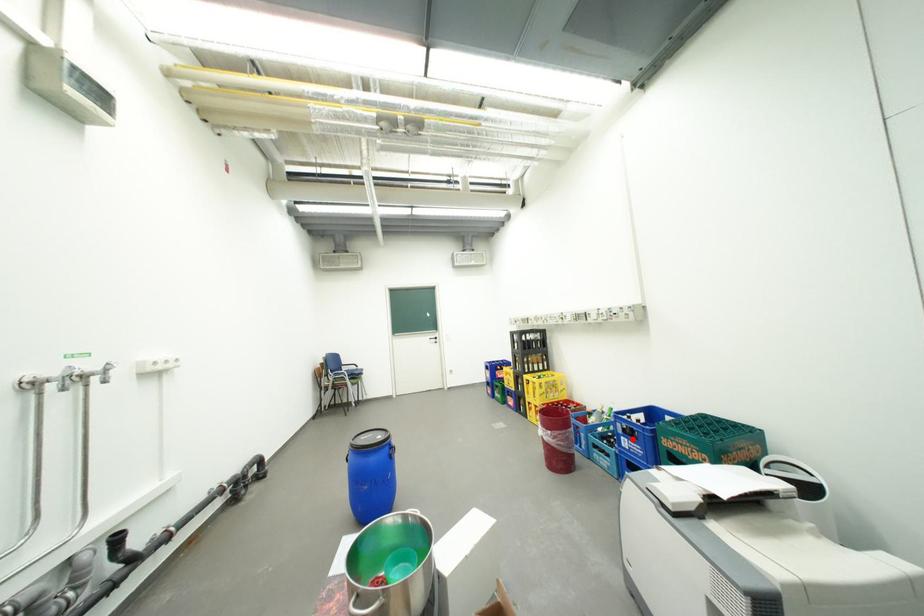
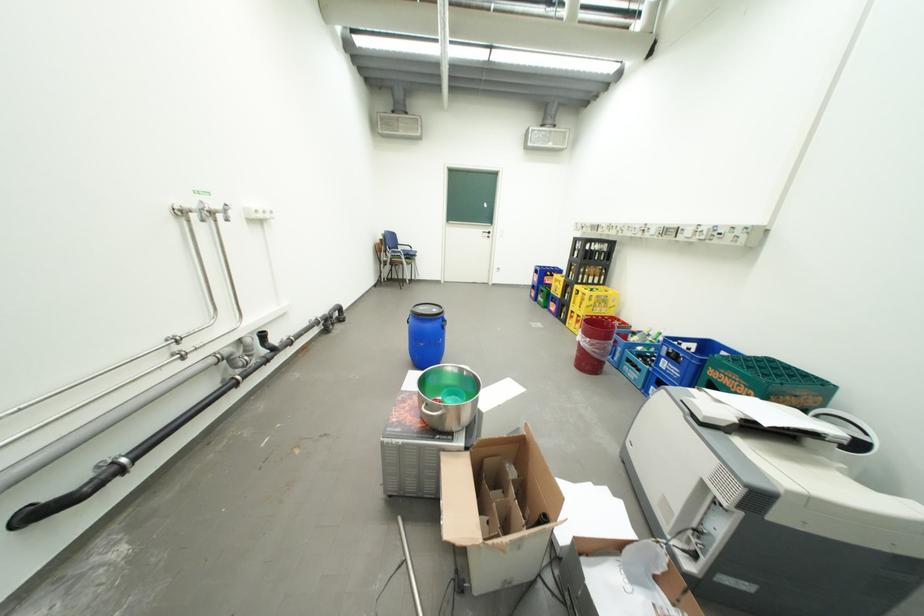
Question: I am providing you with two images of the same scene from different viewpoints. Given a red point in image1, look at the same physical point in image2. Is it:

Choices:
 (A) Closer to the viewpoint
 (B) Farther from the viewpoint

Answer: (A)